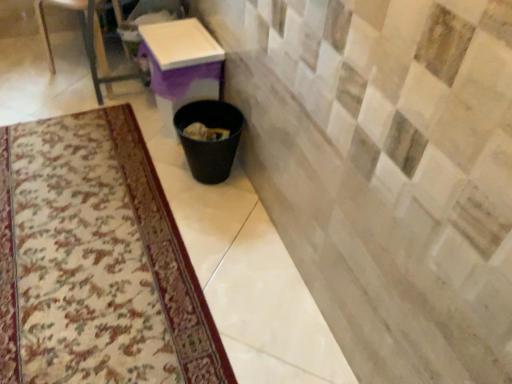
Question: Considering the relative sizes of black plastic trash can at lower center and white glossy table at center in the image provided, is black plastic trash can at lower center wider than white glossy table at center?

Choices:
 (A) no
 (B) yes

Answer: (A)

Question: From a real-world perspective, is black plastic trash can at lower center over white glossy table at center?

Choices:
 (A) no
 (B) yes

Answer: (A)

Question: Is black plastic trash can at lower center next to white glossy table at center and touching it?

Choices:
 (A) yes
 (B) no

Answer: (B)

Question: Does black plastic trash can at lower center have a smaller size compared to white glossy table at center?

Choices:
 (A) no
 (B) yes

Answer: (B)

Question: Considering the relative sizes of black plastic trash can at lower center and white glossy table at center in the image provided, is black plastic trash can at lower center thinner than white glossy table at center?

Choices:
 (A) no
 (B) yes

Answer: (B)

Question: Can you confirm if black plastic trash can at lower center is positioned to the left of white glossy table at center?

Choices:
 (A) yes
 (B) no

Answer: (B)

Question: Is metallic glass table at upper left outside of white glossy table at center?

Choices:
 (A) yes
 (B) no

Answer: (A)

Question: Is metallic glass table at upper left bigger than white glossy table at center?

Choices:
 (A) yes
 (B) no

Answer: (A)

Question: Is white glossy table at center at the back of metallic glass table at upper left?

Choices:
 (A) yes
 (B) no

Answer: (B)

Question: Can you confirm if metallic glass table at upper left is positioned to the left of white glossy table at center?

Choices:
 (A) yes
 (B) no

Answer: (A)

Question: From a real-world perspective, is metallic glass table at upper left over white glossy table at center?

Choices:
 (A) yes
 (B) no

Answer: (A)

Question: Is the position of metallic glass table at upper left less distant than that of white glossy table at center?

Choices:
 (A) no
 (B) yes

Answer: (A)

Question: Does white glossy table at center have a greater width compared to metallic glass table at upper left?

Choices:
 (A) yes
 (B) no

Answer: (B)